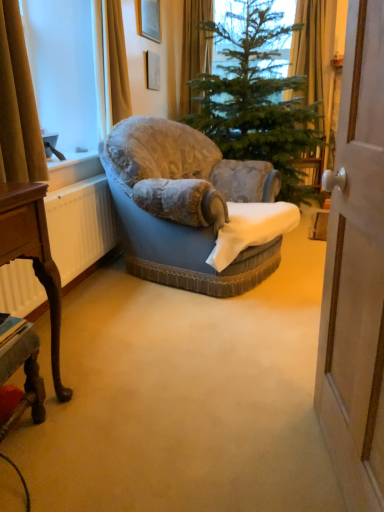
Where is `spots to the right of wooden desk at lower left, which is the first desk from bottom to top`? The width and height of the screenshot is (384, 512). spots to the right of wooden desk at lower left, which is the first desk from bottom to top is located at coordinates (71, 443).